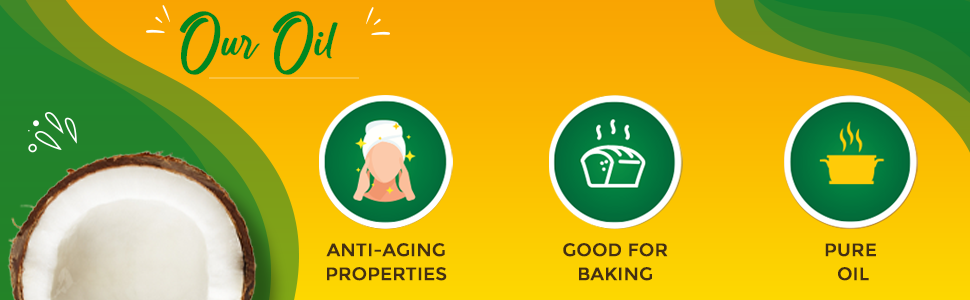
The height and width of the screenshot is (300, 970). I want to click on pot, so click(861, 165).